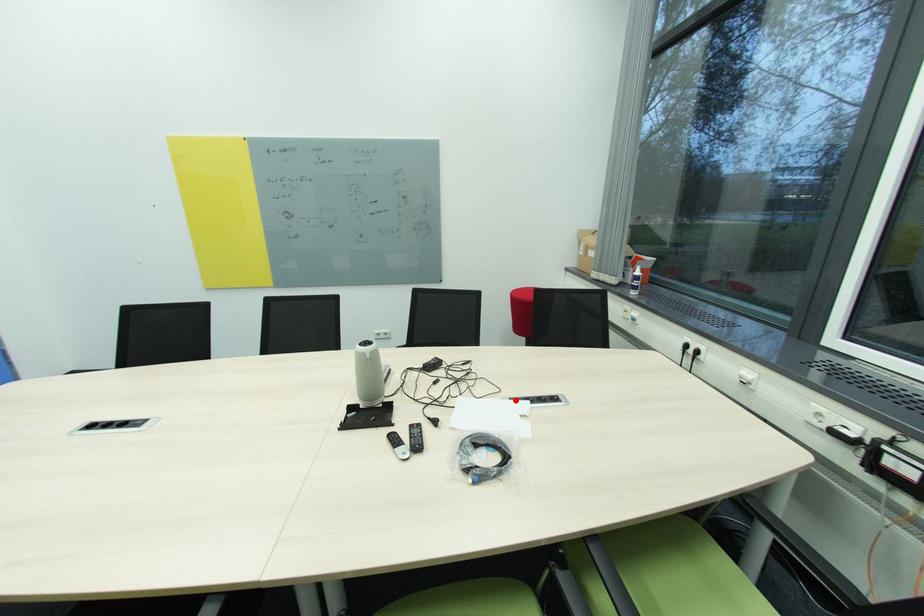
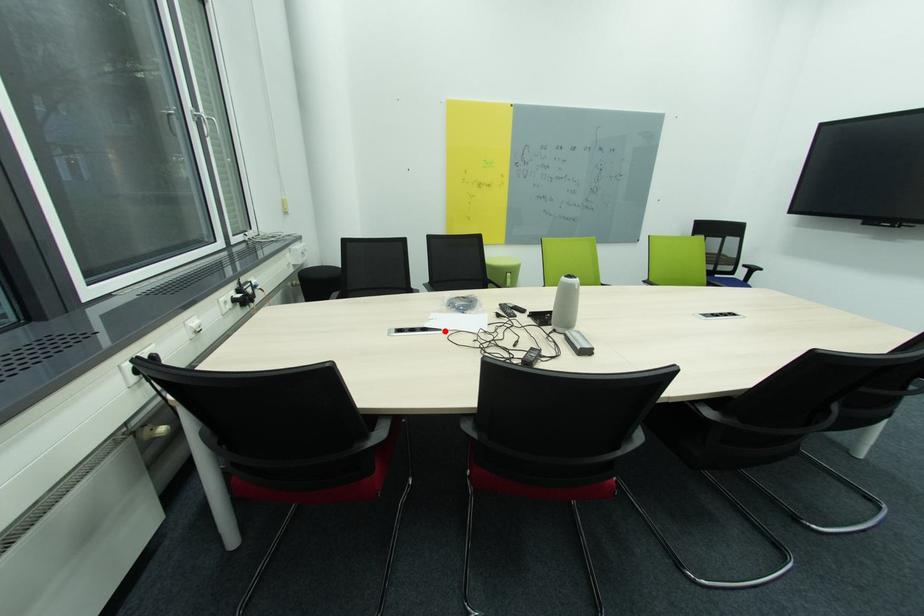
I am providing you with two images of the same scene from different viewpoints. A red point is marked on the first image and another point is marked on the second image. Is the marked point in image1 the same physical position as the marked point in image2?

Yes